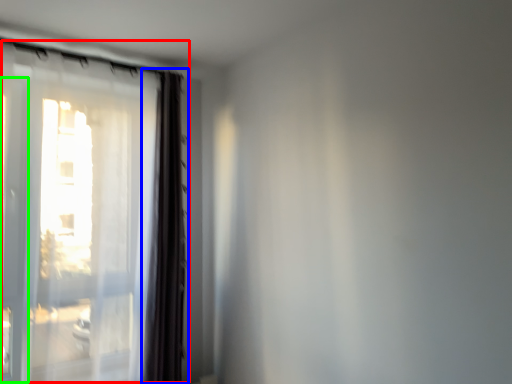
Question: Estimate the real-world distances between objects in this image. Which object is closer to window (highlighted by a red box), curtain (highlighted by a blue box) or screen door (highlighted by a green box)?

Choices:
 (A) curtain
 (B) screen door

Answer: (A)